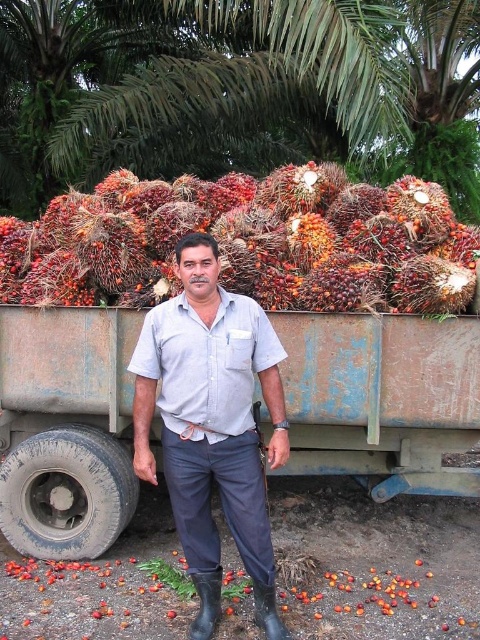
Question: Is green leafy palm at upper center thinner than rustic brown coconuts at center?

Choices:
 (A) no
 (B) yes

Answer: (A)

Question: Where is rusty metal wagon at center located in relation to matte gray shirt at center in the image?

Choices:
 (A) left
 (B) right

Answer: (A)

Question: Which point is closer to the camera?

Choices:
 (A) (203, 486)
 (B) (343, 28)

Answer: (A)

Question: Which of the following is the farthest from the observer?

Choices:
 (A) (155, 284)
 (B) (182, 349)
 (C) (451, 362)

Answer: (A)

Question: Is rusty metal wagon at center behind green leafy palm at upper center?

Choices:
 (A) yes
 (B) no

Answer: (B)

Question: Which point is closer to the camera?

Choices:
 (A) matte gray shirt at center
 (B) rusty metal wagon at center

Answer: (A)